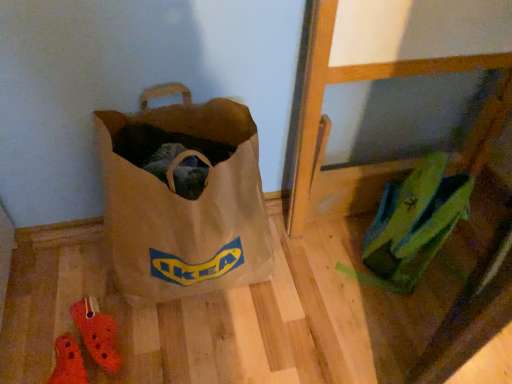
You are a GUI agent. You are given a task and a screenshot of the screen. Output one action in this format:
    pyautogui.click(x=<x>, y=<y>)
    Task: Click on the vacant area that is situated to the right of rubber crocs at lower left, which ranks as the second footwear in top-to-bottom order
    This screenshot has width=512, height=384.
    Given the screenshot: What is the action you would take?
    pyautogui.click(x=163, y=356)